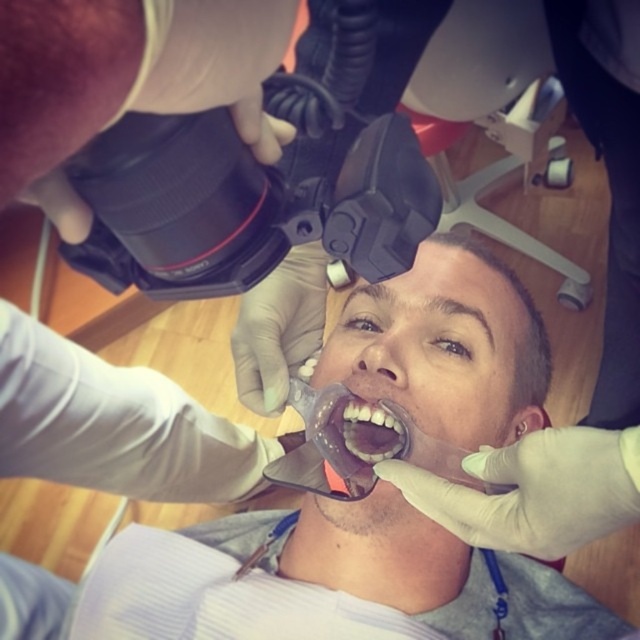
Based on the scene description, which object is positioned lower between the clear plastic mouthguard at center and the translucent plastic mouthpiece at center?

The clear plastic mouthguard at center is located below the translucent plastic mouthpiece at center, so it is positioned lower.

You are a dental technician trying to adjust the position of the clear plastic mouthguard at center and the translucent plastic mouthpiece at center. Which one is closer to the camera?

The clear plastic mouthguard at center is closer to the camera because it is in front of the translucent plastic mouthpiece at center.

You are a photographer trying to capture the dental procedure. You notice two points in the image at coordinates point (385, 364) and point (404, 444). Which point is closer to the camera?

Point (404, 444) is closer to the camera because point (385, 364) is behind it.